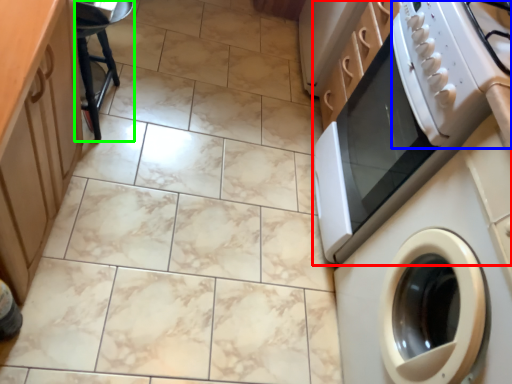
Question: Considering the real-world distances, which object is closest to home appliance (highlighted by a red box)? gas stove (highlighted by a blue box) or bar stool (highlighted by a green box).

Choices:
 (A) gas stove
 (B) bar stool

Answer: (A)